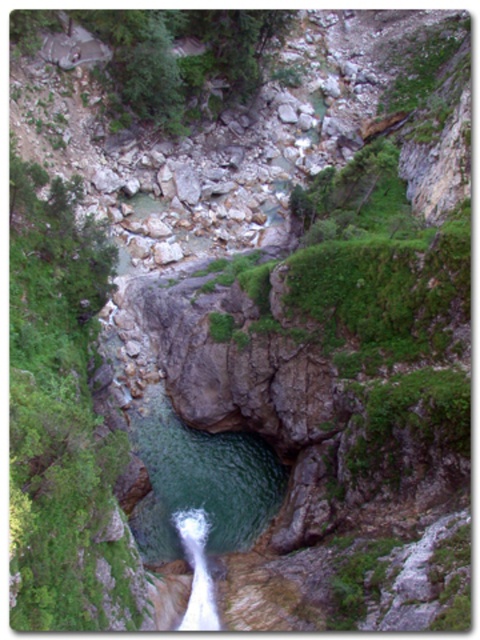
Question: Does green mossy rock at left appear under white frothy water at center?

Choices:
 (A) no
 (B) yes

Answer: (A)

Question: Can you confirm if green mossy rock at left is positioned to the left of white frothy water at center?

Choices:
 (A) yes
 (B) no

Answer: (A)

Question: In this image, where is green mossy rock at left located relative to white frothy water at center?

Choices:
 (A) below
 (B) above

Answer: (B)

Question: Which object appears farthest from the camera in this image?

Choices:
 (A) white frothy water at center
 (B) green mossy rock at left

Answer: (A)

Question: Which object is farther from the camera taking this photo?

Choices:
 (A) white frothy water at center
 (B) green mossy rock at left

Answer: (A)